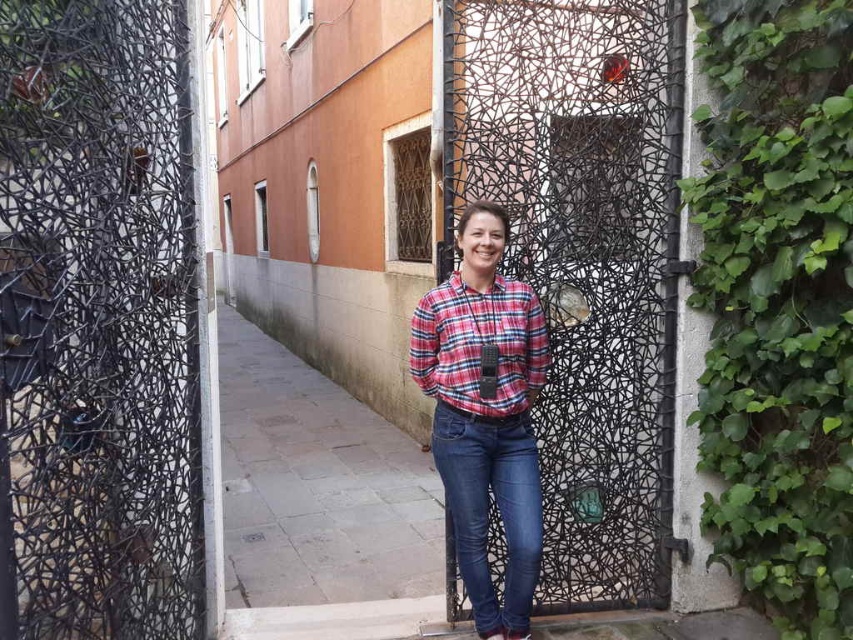
Question: Among these points, which one is nearest to the camera?

Choices:
 (A) (735, 212)
 (B) (509, 616)

Answer: (B)

Question: Does plaid cotton shirt at center appear over plaid fabric shirt at center?

Choices:
 (A) no
 (B) yes

Answer: (A)

Question: Is black textured gate at center above green leafy ivy at right?

Choices:
 (A) no
 (B) yes

Answer: (B)

Question: Does green leafy ivy at right have a greater width compared to plaid fabric shirt at center?

Choices:
 (A) yes
 (B) no

Answer: (B)

Question: Estimate the real-world distances between objects in this image. Which object is farther from the black textured gate at center?

Choices:
 (A) denim jeans at center
 (B) plaid fabric shirt at center
 (C) green leafy ivy at right
 (D) plaid cotton shirt at center

Answer: (A)

Question: Which of the following is the farthest from the observer?

Choices:
 (A) (538, 269)
 (B) (505, 358)
 (C) (413, 355)

Answer: (A)